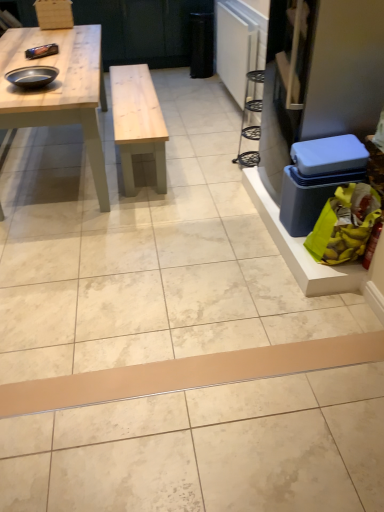
Question: Does black matte bowl at upper left have a lesser width compared to yellow plastic bag at lower right?

Choices:
 (A) no
 (B) yes

Answer: (B)

Question: Can you confirm if black matte bowl at upper left is shorter than yellow plastic bag at lower right?

Choices:
 (A) no
 (B) yes

Answer: (B)

Question: Can you see black matte bowl at upper left touching yellow plastic bag at lower right?

Choices:
 (A) yes
 (B) no

Answer: (B)

Question: From the image's perspective, is black matte bowl at upper left located beneath yellow plastic bag at lower right?

Choices:
 (A) yes
 (B) no

Answer: (B)

Question: Is black matte bowl at upper left behind yellow plastic bag at lower right?

Choices:
 (A) yes
 (B) no

Answer: (A)

Question: Looking at their shapes, would you say blue plastic box at right is wider or thinner than yellow plastic bag at lower right?

Choices:
 (A) wide
 (B) thin

Answer: (A)

Question: From a real-world perspective, is blue plastic box at right above or below yellow plastic bag at lower right?

Choices:
 (A) below
 (B) above

Answer: (B)

Question: From their relative heights in the image, would you say blue plastic box at right is taller or shorter than yellow plastic bag at lower right?

Choices:
 (A) short
 (B) tall

Answer: (B)

Question: Do you think blue plastic box at right is within yellow plastic bag at lower right, or outside of it?

Choices:
 (A) inside
 (B) outside

Answer: (B)

Question: From their relative heights in the image, would you say blue plastic box at right is taller or shorter than black matte bowl at upper left?

Choices:
 (A) short
 (B) tall

Answer: (B)

Question: Does point (292, 167) appear closer or farther from the camera than point (29, 69)?

Choices:
 (A) closer
 (B) farther

Answer: (A)

Question: From a real-world perspective, relative to black matte bowl at upper left, is blue plastic box at right vertically above or below?

Choices:
 (A) above
 (B) below

Answer: (B)

Question: From the image's perspective, relative to black matte bowl at upper left, is blue plastic box at right above or below?

Choices:
 (A) above
 (B) below

Answer: (B)

Question: Is black matte bowl at upper left in front of or behind beige matte plank at center in the image?

Choices:
 (A) front
 (B) behind

Answer: (B)

Question: Is black matte bowl at upper left wider or thinner than beige matte plank at center?

Choices:
 (A) thin
 (B) wide

Answer: (B)